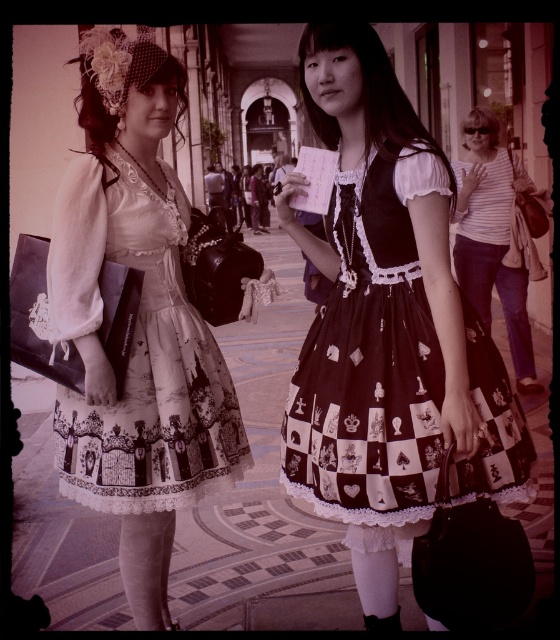
You are a photographer positioned at the entrance of the arcade. You need to arrange the two subjects so that the white lace dress at center is to the left of the white striped shirt at right. Based on their current positions, is this arrangement already achieved?

Yes, the white lace dress at center is already positioned to the left of the white striped shirt at right, so the arrangement is correct.

You are a photographer positioned at the entrance of the arcade. You need to capture a photo that includes both the black satin dress at center and the white striped shirt at right. Which subject should you focus on first to ensure both are in frame?

The black satin dress at center is in front of the white striped shirt at right, so you should focus on the black satin dress at center first to ensure both are in frame.